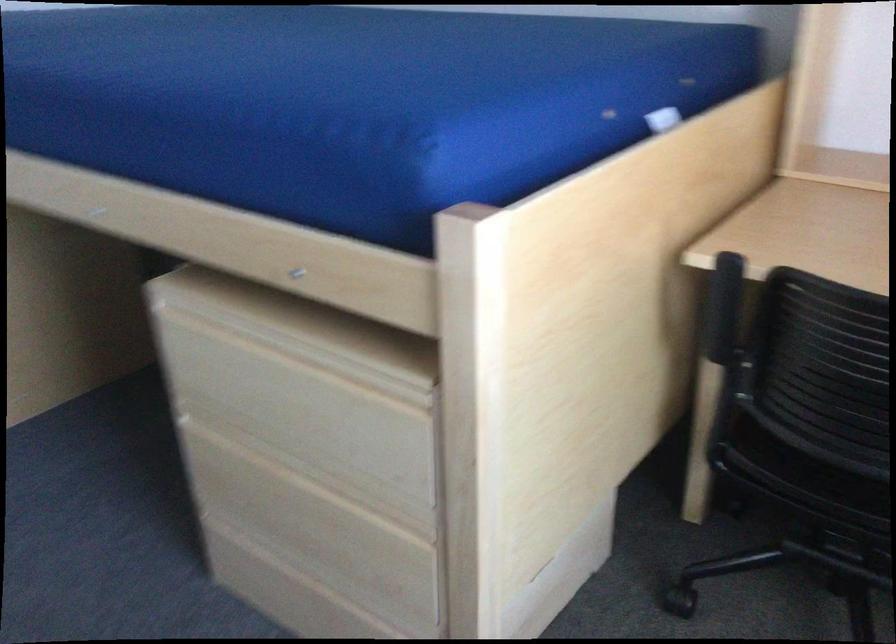
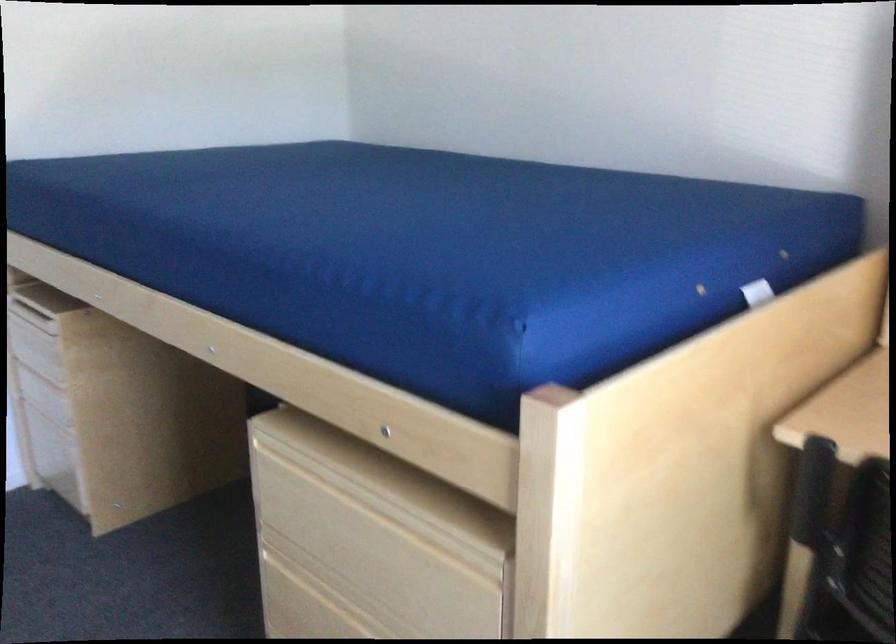
Where in the second image is the point corresponding to point 315,339 from the first image?

(397, 491)